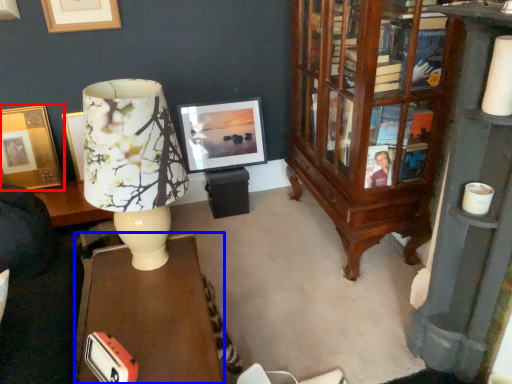
Question: Which of the following is the closest to the observer, picture frame (highlighted by a red box) or desk (highlighted by a blue box)?

Choices:
 (A) picture frame
 (B) desk

Answer: (B)